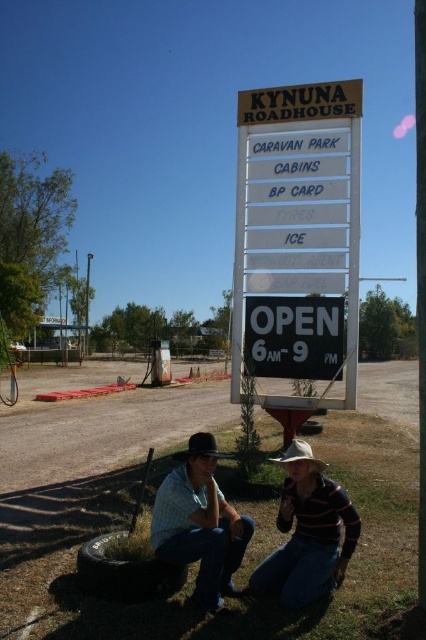
Question: Estimate the real-world distances between objects in this image. Which object is closer to the brown wooden sign at center?

Choices:
 (A) black felt cowboy hat at lower center
 (B) striped cotton shirt at lower center
 (C) denim jeans at lower center
 (D) white felt cowboy hat at lower center

Answer: (B)

Question: Which point is closer to the camera?

Choices:
 (A) striped cotton shirt at lower center
 (B) black felt cowboy hat at lower center

Answer: (A)

Question: Which of the following is the farthest from the observer?

Choices:
 (A) brown wooden sign at center
 (B) striped cotton shirt at lower center
 (C) denim jeans at lower center
 (D) white felt cowboy hat at lower center

Answer: (A)

Question: Where is brown wooden sign at center located in relation to black felt cowboy hat at lower center in the image?

Choices:
 (A) right
 (B) left

Answer: (A)

Question: Does denim jeans at lower center have a lesser width compared to white felt cowboy hat at lower center?

Choices:
 (A) no
 (B) yes

Answer: (A)

Question: Can you confirm if striped cotton shirt at lower center is positioned to the left of denim jeans at lower center?

Choices:
 (A) no
 (B) yes

Answer: (A)